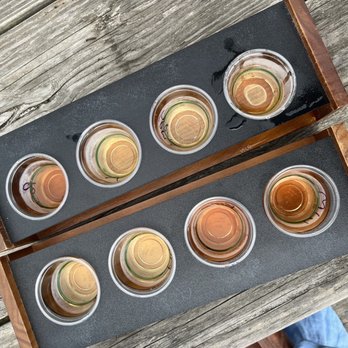
Find the location of a particular element. The width and height of the screenshot is (348, 348). brown trim is located at coordinates (321, 71).